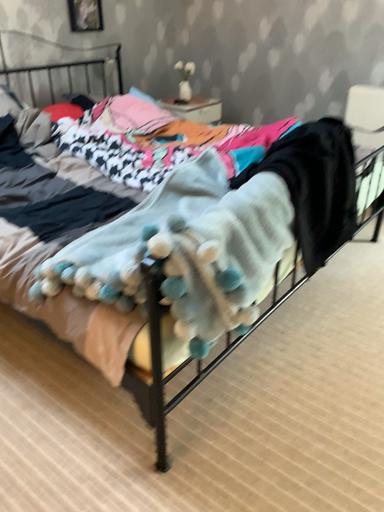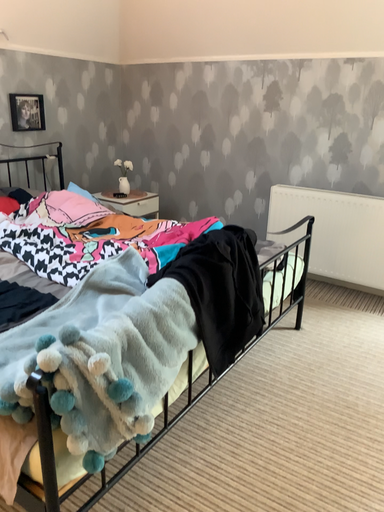
Question: How did the camera likely rotate when shooting the video?

Choices:
 (A) rotated downward
 (B) rotated upward

Answer: (B)